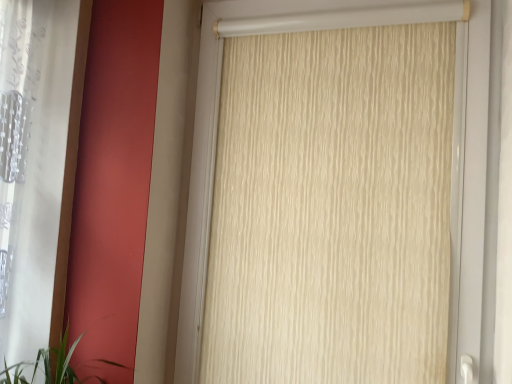
The image size is (512, 384). What do you see at coordinates (332, 208) in the screenshot?
I see `beige textured curtain at center` at bounding box center [332, 208].

Based on the photo, measure the distance between point [295,202] and camera.

They are 1.35 meters apart.

What is the approximate width of beige textured curtain at center?

beige textured curtain at center is 2.81 inches in width.

The height and width of the screenshot is (384, 512). What are the coordinates of `beige textured curtain at center` in the screenshot? It's located at (332, 208).

Find the location of a particular element. The height and width of the screenshot is (384, 512). beige textured curtain at center is located at coordinates (332, 208).